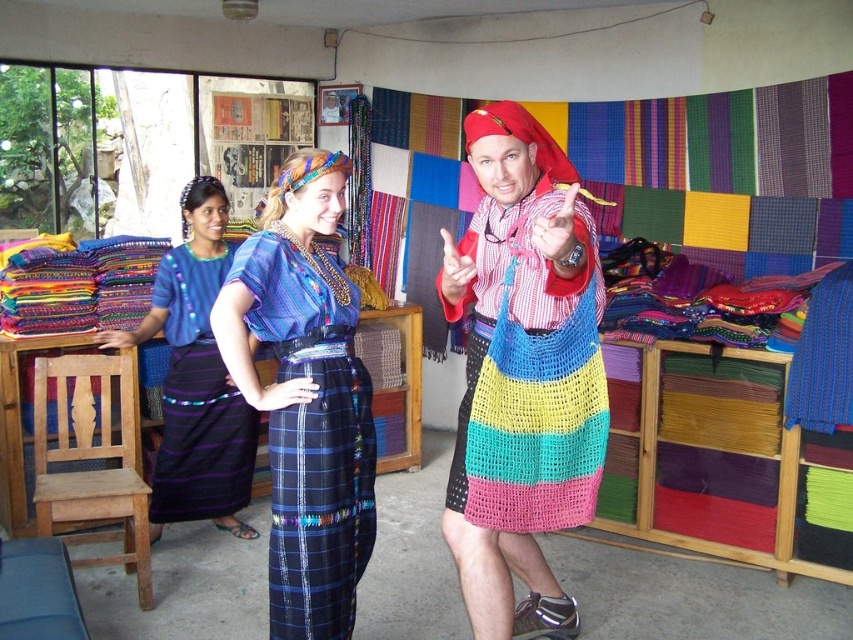
The image size is (853, 640). Describe the element at coordinates (305, 397) in the screenshot. I see `matte blue fabric dress at center` at that location.

Is matte blue fabric dress at center shorter than blue plaid skirt at center?

Correct, matte blue fabric dress at center is not as tall as blue plaid skirt at center.

Where is `matte blue fabric dress at center`? Image resolution: width=853 pixels, height=640 pixels. matte blue fabric dress at center is located at coordinates (305, 397).

Does matte blue fabric dress at center appear under multicolored knitted bag at center?

Yes.

The height and width of the screenshot is (640, 853). I want to click on matte blue fabric dress at center, so click(x=305, y=397).

Between point (274, 326) and point (560, 474), which one is positioned behind?

Positioned behind is point (274, 326).

Image resolution: width=853 pixels, height=640 pixels. Find the location of `matte blue fabric dress at center`. matte blue fabric dress at center is located at coordinates [305, 397].

Is point (543, 323) closer to viewer compared to point (213, 424)?

Yes, it is.

The height and width of the screenshot is (640, 853). In order to click on multicolored knitted bag at center in this screenshot , I will do `click(529, 376)`.

At what (x,y) coordinates should I click in order to perform the action: click on multicolored knitted bag at center. Please return your answer as a coordinate pair (x, y). Looking at the image, I should click on (529, 376).